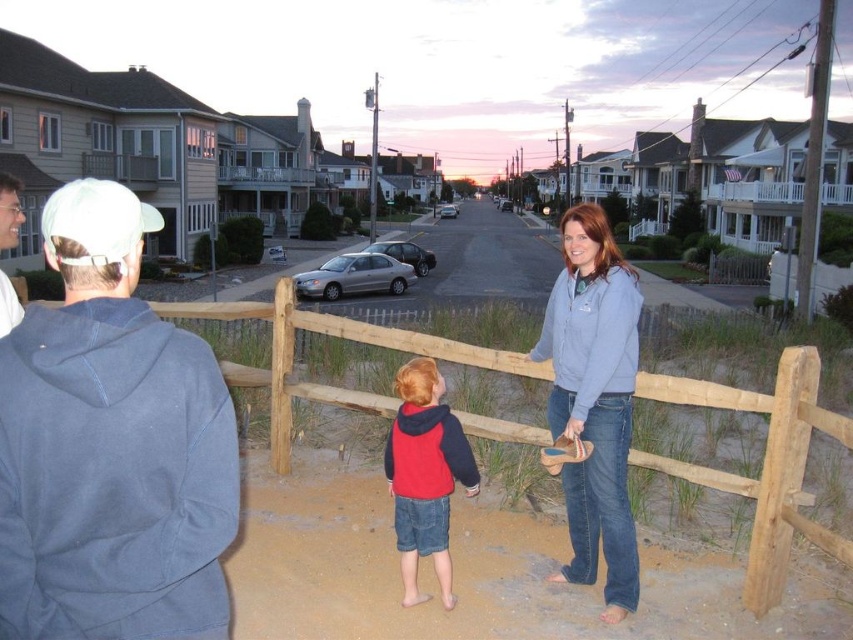
Question: Which point appears closest to the camera in this image?

Choices:
 (A) (750, 488)
 (B) (112, 611)
 (C) (9, 321)
 (D) (401, 385)

Answer: (B)

Question: Is light blue fleece jacket at left bigger than matte gray hoodie at left?

Choices:
 (A) no
 (B) yes

Answer: (A)

Question: Which point is closer to the camera?

Choices:
 (A) light blue fleece jacket at left
 (B) wooden fence at center

Answer: (A)

Question: Among these points, which one is farthest from the camera?

Choices:
 (A) (15, 317)
 (B) (457, 476)

Answer: (B)

Question: In this image, where is denim jacket at center located relative to matte gray hoodie at left?

Choices:
 (A) above
 (B) below

Answer: (B)

Question: Does denim jacket at center have a lesser width compared to matte gray hoodie at left?

Choices:
 (A) no
 (B) yes

Answer: (B)